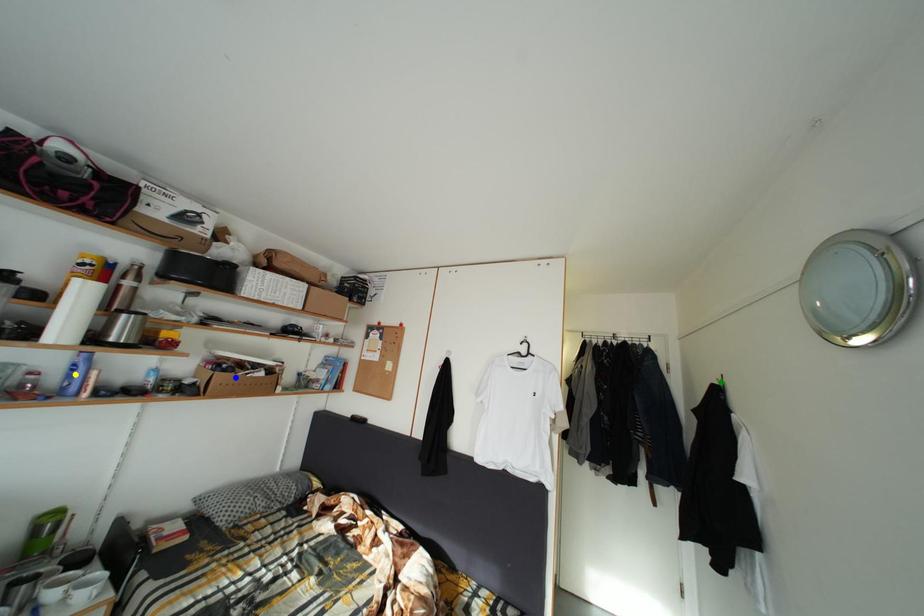
Order these from nearest to farthest:
green point, yellow point, blue point

1. yellow point
2. green point
3. blue point